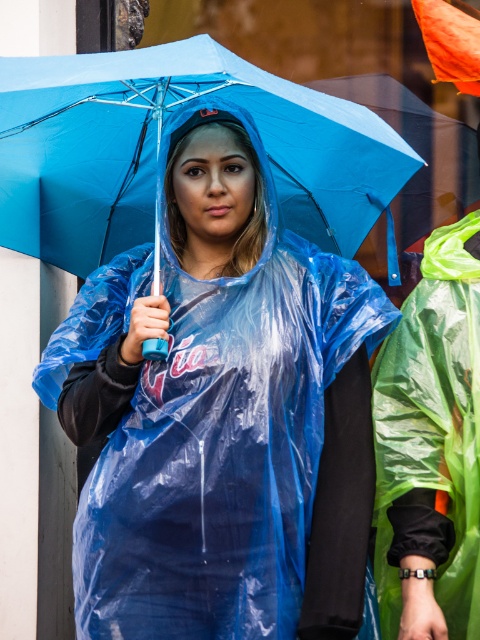
You are a delivery person who needs to choose between the transparent plastic umbrella at center and the blue matte umbrella at center to protect your package from the rain. Which umbrella would provide a wider coverage area?

The transparent plastic umbrella at center has a greater width than the blue matte umbrella at center, so it would provide a wider coverage area for the package.

You are a delivery person who needs to carry a large package. You are currently wearing the transparent plastic raincoat at center and holding the blue matte umbrella at center. Can you fit the package under the umbrella while wearing the raincoat?

The transparent plastic raincoat at center is larger in size than the blue matte umbrella at center, so the umbrella may not provide enough coverage for both you and the package. Consider finding a larger umbrella or alternative shelter.